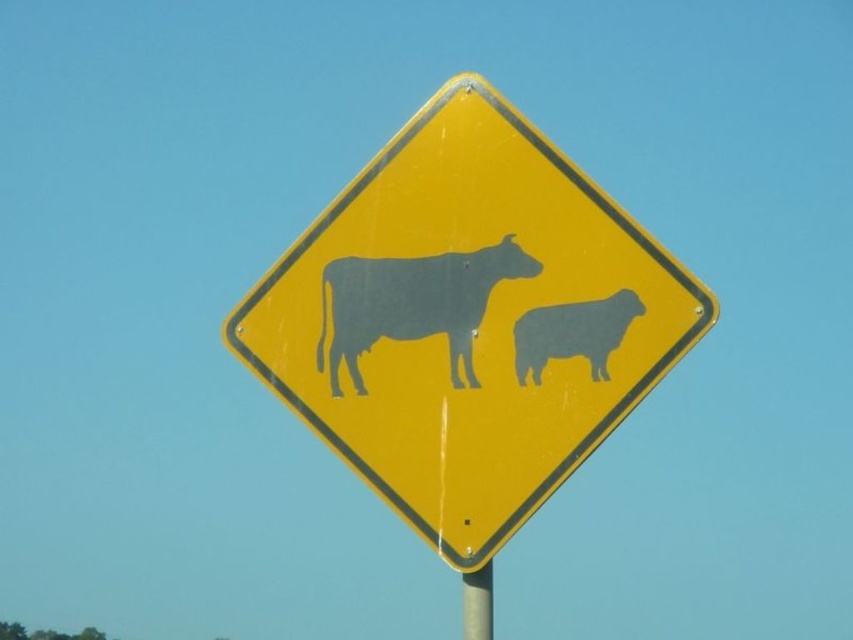
The height and width of the screenshot is (640, 853). I want to click on matte gray bull at center, so click(410, 305).

Is point (328, 269) farther from viewer compared to point (491, 580)?

Yes, point (328, 269) is behind point (491, 580).

Identify the location of matte gray bull at center. (410, 305).

This screenshot has height=640, width=853. I want to click on matte gray bull at center, so click(410, 305).

Does matte gray bull at center appear under gray matte sheep at center?

Actually, matte gray bull at center is above gray matte sheep at center.

Where is `matte gray bull at center`? matte gray bull at center is located at coordinates (410, 305).

At what (x,y) coordinates should I click in order to perform the action: click on matte gray bull at center. Please return your answer as a coordinate pair (x, y). The image size is (853, 640). Looking at the image, I should click on tap(410, 305).

Can you confirm if gray matte sheep at center is positioned above metallic yellow pole at center?

Yes.

Who is more distant from viewer, [596,304] or [486,604]?

The point [596,304] is behind.

Where is `gray matte sheep at center`? gray matte sheep at center is located at coordinates (573, 333).